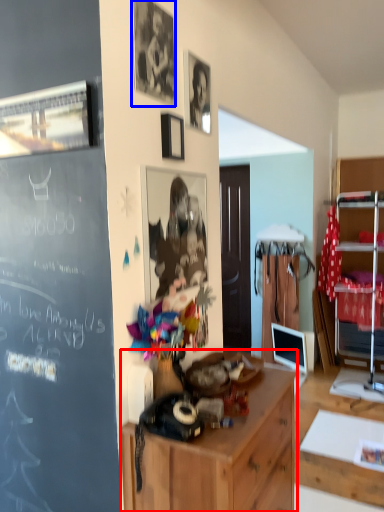
Question: Among these objects, which one is nearest to the camera, cabinetry (highlighted by a red box) or picture frame (highlighted by a blue box)?

Choices:
 (A) cabinetry
 (B) picture frame

Answer: (A)